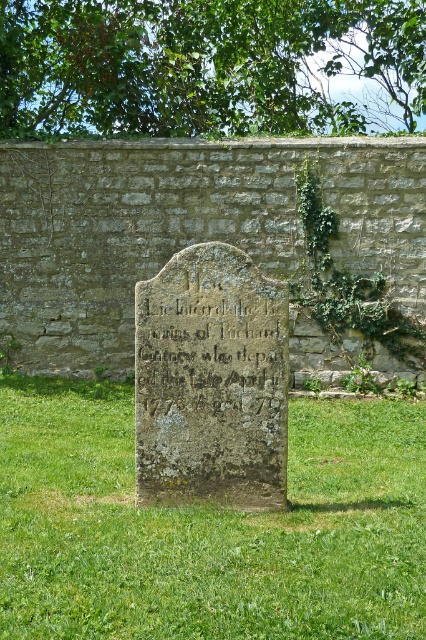
Question: Considering the relative positions of green mossy stone at center and green mossy stone monument at center in the image provided, where is green mossy stone at center located with respect to green mossy stone monument at center?

Choices:
 (A) below
 (B) above

Answer: (A)

Question: Which object is farther from the camera taking this photo?

Choices:
 (A) green mossy stone monument at center
 (B) green leafy tree at upper center

Answer: (B)

Question: Can you confirm if green mossy stone at center is smaller than green leafy tree at upper center?

Choices:
 (A) yes
 (B) no

Answer: (A)

Question: Which point is farther to the camera?

Choices:
 (A) (149, 349)
 (B) (301, 500)
 (C) (118, 22)
 (D) (244, 308)

Answer: (C)

Question: Which point is closer to the camera?

Choices:
 (A) green mossy stone at center
 (B) carved stone inscription at center
 (C) green leafy tree at upper center

Answer: (A)

Question: In this image, where is green leafy tree at upper center located relative to carved stone inscription at center?

Choices:
 (A) above
 (B) below

Answer: (A)